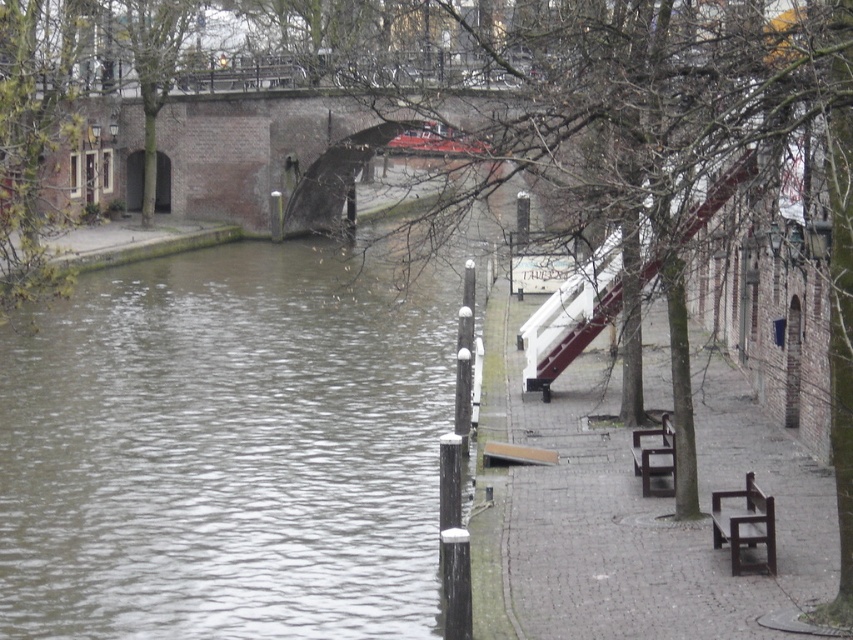
Question: Which of these objects is positioned farthest from the brown wooden bench at lower center?

Choices:
 (A) dark brown wooden bench at lower right
 (B) white painted wood rail at center right

Answer: (A)

Question: Can you confirm if white painted wood rail at center right is wider than brown wooden bench at lower center?

Choices:
 (A) no
 (B) yes

Answer: (B)

Question: Which point is farther to the camera?

Choices:
 (A) (764, 531)
 (B) (672, 490)

Answer: (B)

Question: Where is white painted wood rail at center right located in relation to dark brown wooden bench at lower right in the image?

Choices:
 (A) above
 (B) below

Answer: (A)

Question: Estimate the real-world distances between objects in this image. Which object is closer to the white painted wood rail at center right?

Choices:
 (A) gray concrete river at center
 (B) dark brown wooden bench at lower right
 (C) brown wooden bench at lower center

Answer: (C)

Question: Is gray concrete river at center smaller than dark brown wooden bench at lower right?

Choices:
 (A) yes
 (B) no

Answer: (B)